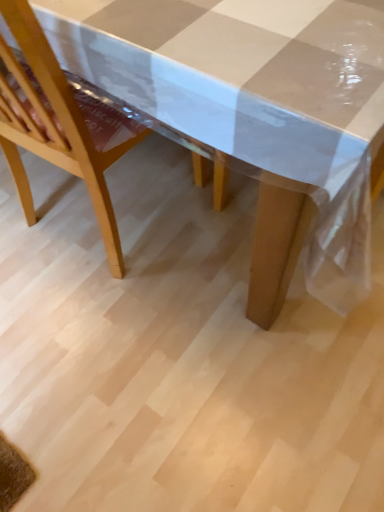
Identify the location of transparent plastic picnic table at center. (250, 119).

Describe the element at coordinates (250, 119) in the screenshot. I see `transparent plastic picnic table at center` at that location.

Image resolution: width=384 pixels, height=512 pixels. What do you see at coordinates (60, 122) in the screenshot?
I see `light wood chair at center` at bounding box center [60, 122].

Where is `light wood chair at center`? light wood chair at center is located at coordinates (60, 122).

Image resolution: width=384 pixels, height=512 pixels. Find the location of `transparent plastic picnic table at center`. transparent plastic picnic table at center is located at coordinates (250, 119).

In the image, is transparent plastic picnic table at center on the left side or the right side of light wood chair at center?

transparent plastic picnic table at center is to the right of light wood chair at center.

Relative to light wood chair at center, is transparent plastic picnic table at center in front or behind?

transparent plastic picnic table at center is in front of light wood chair at center.

Which is in front, point (278, 68) or point (96, 96)?

The point (278, 68) is more forward.

From the image's perspective, does transparent plastic picnic table at center appear higher than light wood chair at center?

Indeed, from the image's perspective, transparent plastic picnic table at center is shown above light wood chair at center.

From a real-world perspective, is transparent plastic picnic table at center on top of light wood chair at center?

No.

Which of these two, transparent plastic picnic table at center or light wood chair at center, is thinner?

light wood chair at center is thinner.

Which of these two, transparent plastic picnic table at center or light wood chair at center, stands taller?

Standing taller between the two is light wood chair at center.

Is transparent plastic picnic table at center smaller than light wood chair at center?

Actually, transparent plastic picnic table at center might be larger than light wood chair at center.

Is transparent plastic picnic table at center situated inside light wood chair at center or outside?

transparent plastic picnic table at center is located beyond the bounds of light wood chair at center.

Can you see transparent plastic picnic table at center touching light wood chair at center?

They are not placed beside each other.

Does transparent plastic picnic table at center turn towards light wood chair at center?

Yes.

How different are the orientations of transparent plastic picnic table at center and light wood chair at center in degrees?

They differ by 179 degrees in their facing directions.

How much distance is there between transparent plastic picnic table at center and light wood chair at center?

transparent plastic picnic table at center and light wood chair at center are 11.37 inches apart from each other.

The width and height of the screenshot is (384, 512). Identify the location of picnic table located on the right of light wood chair at center. (250, 119).

Visually, is light wood chair at center positioned to the left or to the right of transparent plastic picnic table at center?

In the image, light wood chair at center appears on the left side of transparent plastic picnic table at center.

In the image, is light wood chair at center positioned in front of or behind transparent plastic picnic table at center?

Visually, light wood chair at center is located behind transparent plastic picnic table at center.

Does point (94, 197) appear closer or farther from the camera than point (132, 109)?

Point (94, 197) appears to be farther away from the viewer than point (132, 109).

From the image's perspective, which is above, light wood chair at center or transparent plastic picnic table at center?

transparent plastic picnic table at center appears higher in the image.

From a real-world perspective, is light wood chair at center under transparent plastic picnic table at center?

No, from a real-world perspective, light wood chair at center is not below transparent plastic picnic table at center.

Considering the sizes of objects light wood chair at center and transparent plastic picnic table at center in the image provided, who is wider, light wood chair at center or transparent plastic picnic table at center?

With larger width is transparent plastic picnic table at center.

Which of these two, light wood chair at center or transparent plastic picnic table at center, stands shorter?

With less height is transparent plastic picnic table at center.

Considering the relative sizes of light wood chair at center and transparent plastic picnic table at center in the image provided, is light wood chair at center bigger than transparent plastic picnic table at center?

Incorrect, light wood chair at center is not larger than transparent plastic picnic table at center.

Is light wood chair at center situated inside transparent plastic picnic table at center or outside?

light wood chair at center is enclosed within transparent plastic picnic table at center.

Looking at this image, are light wood chair at center and transparent plastic picnic table at center located far from each other?

No, light wood chair at center is not far from transparent plastic picnic table at center.

Is light wood chair at center looking in the opposite direction of transparent plastic picnic table at center?

Absolutely, light wood chair at center is directed away from transparent plastic picnic table at center.

This screenshot has width=384, height=512. I want to click on chair behind the transparent plastic picnic table at center, so click(x=60, y=122).

Where is `picnic table directly beneath the light wood chair at center (from a real-world perspective)`? This screenshot has height=512, width=384. picnic table directly beneath the light wood chair at center (from a real-world perspective) is located at coordinates (250, 119).

Identify the location of chair that appears below the transparent plastic picnic table at center (from the image's perspective). (60, 122).